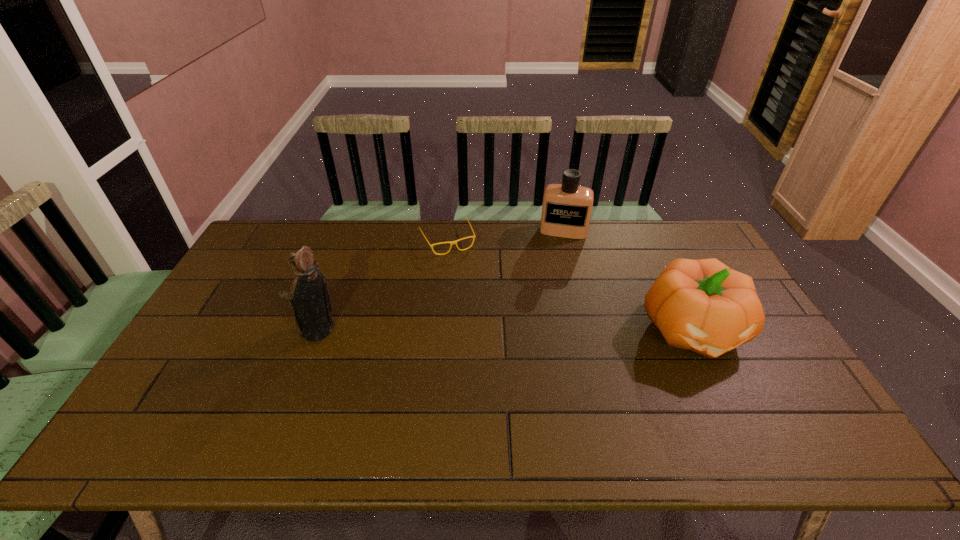
At what (x,y) coordinates should I click in order to perform the action: click on vacant space on the desktop that is between the figurine and the rightmost object and is positioned in front of the lenses of the spectacles. Please return your answer as a coordinate pair (x, y). Looking at the image, I should click on (492, 330).

Find the location of a particular element. free space on the desktop that is between the leftmost object and the pumpkin and is positioned on the front label of the perfume is located at coordinates (550, 330).